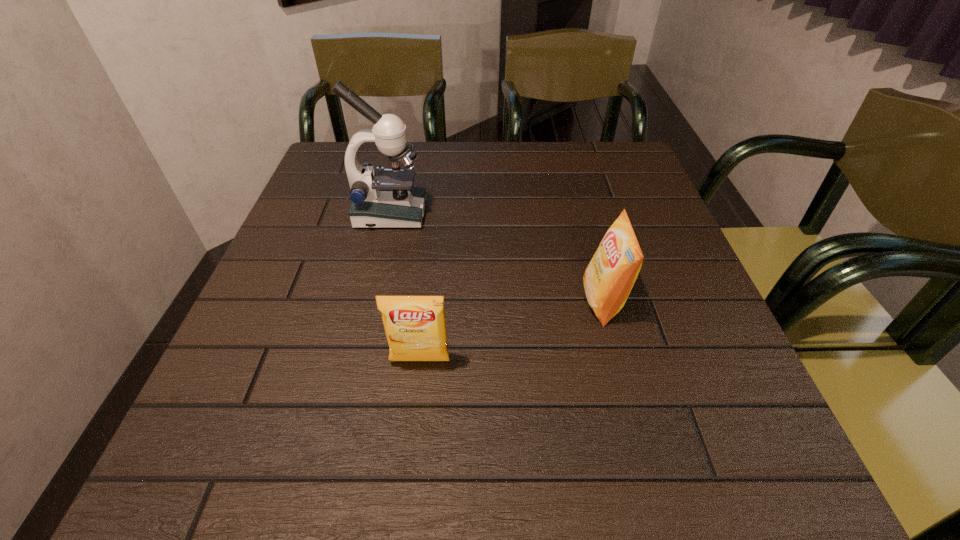
Find the location of a particular element. free spot located on the front of the left crisp (potato chip) with the logo is located at coordinates (409, 460).

Locate an element on the screen. The height and width of the screenshot is (540, 960). object at the left edge is located at coordinates (386, 198).

Find the location of a particular element. The height and width of the screenshot is (540, 960). object that is at the right edge is located at coordinates (609, 277).

In order to click on vacant space at the far edge of the desktop in this screenshot , I will do `click(476, 147)`.

At what (x,y) coordinates should I click in order to perform the action: click on blank area at the near edge. Please return your answer as a coordinate pair (x, y). This screenshot has width=960, height=540. Looking at the image, I should click on (320, 465).

At what (x,y) coordinates should I click in order to perform the action: click on vacant space at the left edge. Please return your answer as a coordinate pair (x, y). Looking at the image, I should click on (262, 304).

This screenshot has width=960, height=540. I want to click on free space at the right edge of the desktop, so click(x=645, y=273).

In the image, there is a desktop. Where is `vacant space at the near left corner`? vacant space at the near left corner is located at coordinates (231, 464).

Where is `free point at the far right corner`? The height and width of the screenshot is (540, 960). free point at the far right corner is located at coordinates (583, 148).

Identify the location of vacant space at the near right corner of the desktop. The height and width of the screenshot is (540, 960). (710, 446).